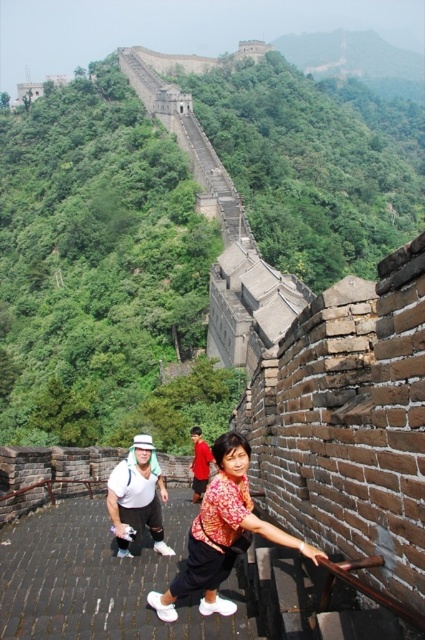
Question: Is matte red blouse at center smaller than white matte hat at upper center?

Choices:
 (A) yes
 (B) no

Answer: (A)

Question: Which object is positioned closest to the white matte hat at upper center?

Choices:
 (A) red shirt at center
 (B) matte red blouse at center

Answer: (B)

Question: Can you confirm if matte red blouse at center is thinner than red shirt at center?

Choices:
 (A) no
 (B) yes

Answer: (A)

Question: Which point appears farthest from the camera in this image?

Choices:
 (A) (215, 577)
 (B) (203, 468)

Answer: (B)

Question: Which of the following is the closest to the observer?

Choices:
 (A) red shirt at center
 (B) matte red blouse at center

Answer: (B)

Question: Does matte red blouse at center appear under white matte hat at upper center?

Choices:
 (A) yes
 (B) no

Answer: (B)